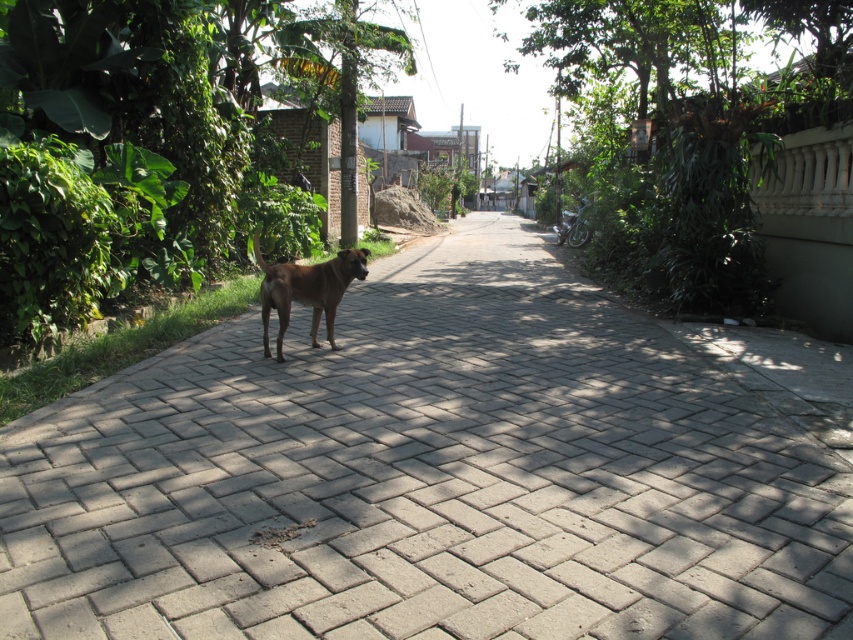
Question: Can you confirm if gray brick pavement at center is bigger than brown furry dog at center?

Choices:
 (A) yes
 (B) no

Answer: (A)

Question: Which point is closer to the camera taking this photo?

Choices:
 (A) (288, 280)
 (B) (383, 406)

Answer: (B)

Question: Observing the image, what is the correct spatial positioning of gray brick pavement at center in reference to brown furry dog at center?

Choices:
 (A) right
 (B) left

Answer: (A)

Question: Which object is closer to the camera taking this photo?

Choices:
 (A) brown furry dog at center
 (B) gray brick pavement at center

Answer: (B)

Question: Does gray brick pavement at center appear on the right side of brown furry dog at center?

Choices:
 (A) no
 (B) yes

Answer: (B)